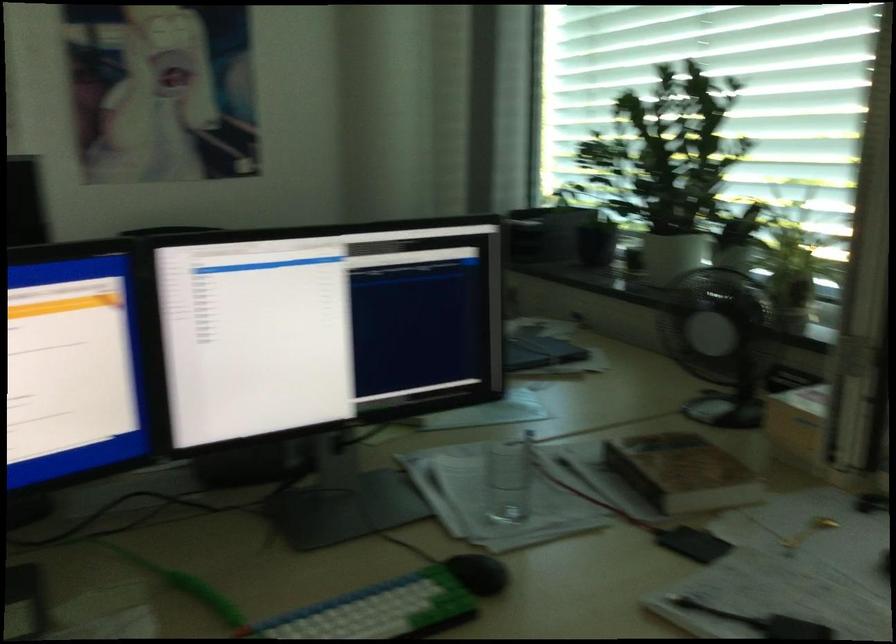
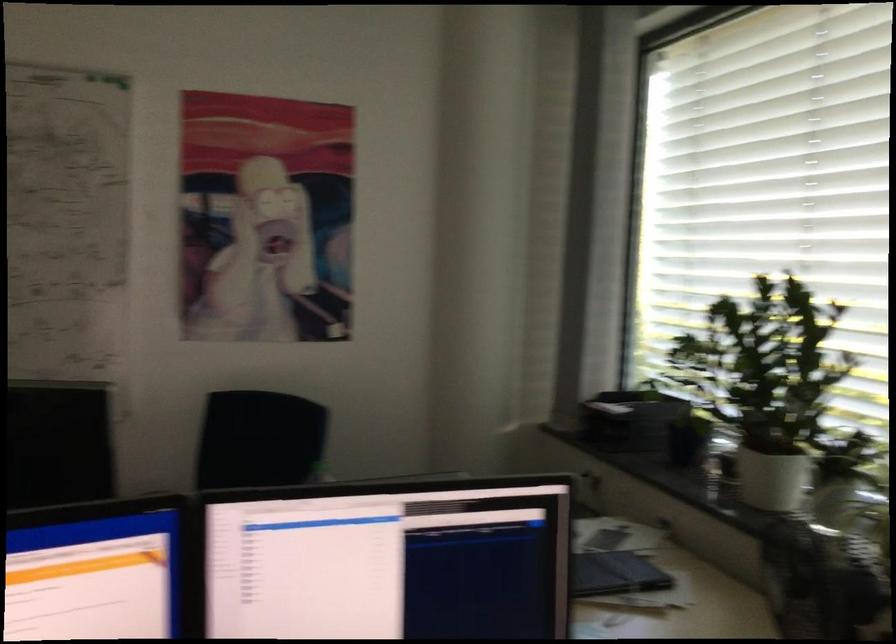
Question: The images are taken continuously from a first-person perspective. In which direction is your viewpoint rotating?

Choices:
 (A) Left
 (B) Right
 (C) Up
 (D) Down

Answer: (C)